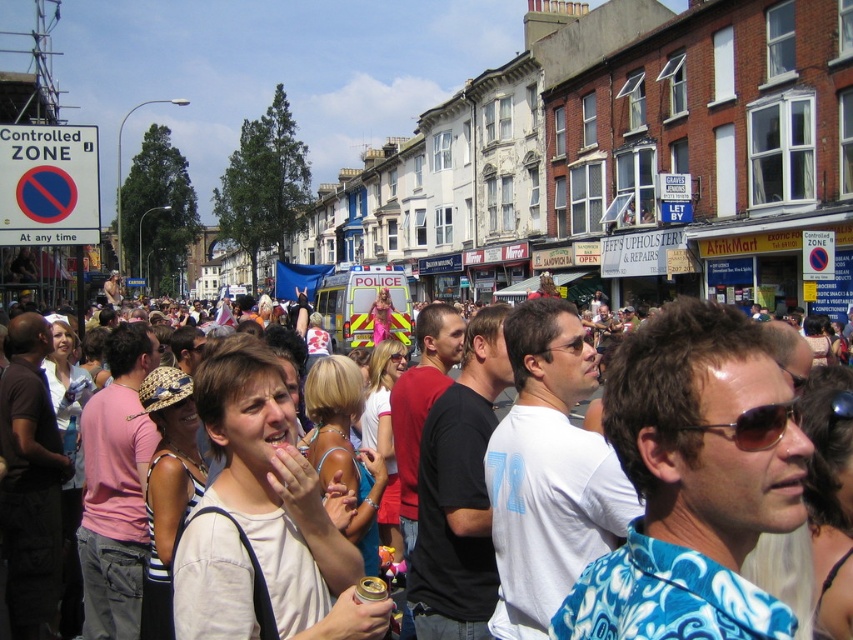
Based on the photo, you are a photographer trying to capture a candid shot of the sunglasses at center without including the white cotton shirt at center. Is it possible to do so given their current positions?

The white cotton shirt at center is positioned over the sunglasses at center, so it would block the view of the sunglasses. Therefore, it is not possible to capture the sunglasses at center without including the white cotton shirt at center in the shot.

You are standing at the edge of the lively street scene and see a person wearing a white cotton shirt at center. If you want to approach them directly, which direction should you move relative to your current position?

Since the white cotton shirt at center is positioned at point 0.753 on the x and 0.811 on the y, you should move towards the center of the image to reach them.

You are standing at the point closest to the camera in the scene. Which of the two points, point [727,394] or point [735,420], is closer to you?

Point [735,420] is closer to you because it is in front of point [727,394].